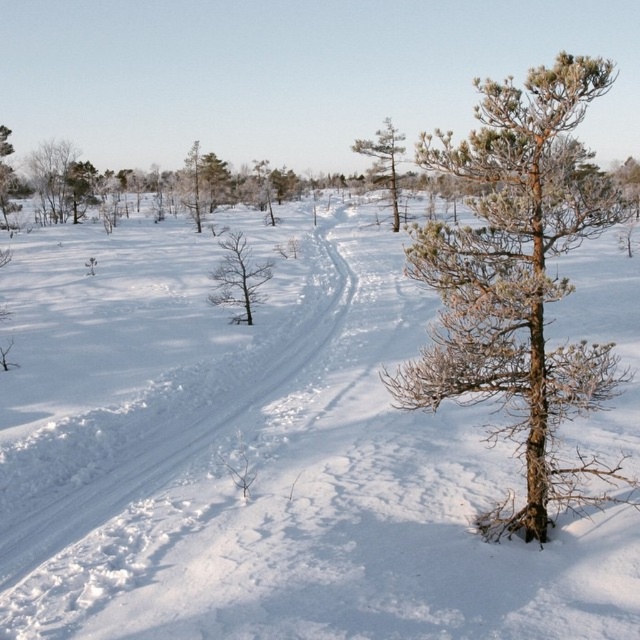
Question: Which of these objects is positioned closest to the snow-covered pine tree at right?

Choices:
 (A) brown/dry wood tree at center
 (B) green needle-like tree at center

Answer: (A)

Question: Can you confirm if snow-covered pine tree at right is positioned to the right of brown/dry wood tree at center?

Choices:
 (A) yes
 (B) no

Answer: (A)

Question: Is brown/dry wood tree at center above green needle-like tree at center?

Choices:
 (A) no
 (B) yes

Answer: (A)

Question: Which object appears closest to the camera in this image?

Choices:
 (A) brown/dry wood tree at center
 (B) snow-covered pine tree at right
 (C) green needle-like tree at center

Answer: (B)

Question: Is snow-covered pine tree at right smaller than green needle-like tree at center?

Choices:
 (A) no
 (B) yes

Answer: (A)

Question: Based on their relative distances, which object is farther from the snow-covered pine tree at right?

Choices:
 (A) brown/dry wood tree at center
 (B) green needle-like tree at center

Answer: (B)